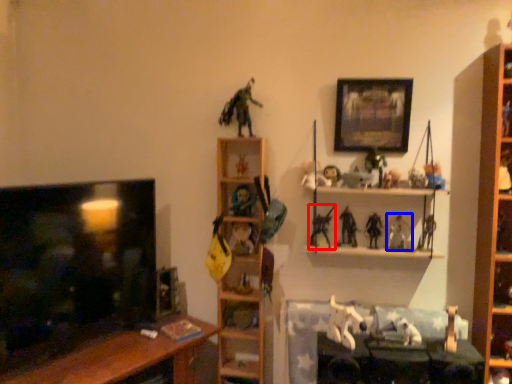
Question: Among these objects, which one is nearest to the camera, toy (highlighted by a red box) or toy (highlighted by a blue box)?

Choices:
 (A) toy
 (B) toy

Answer: (A)